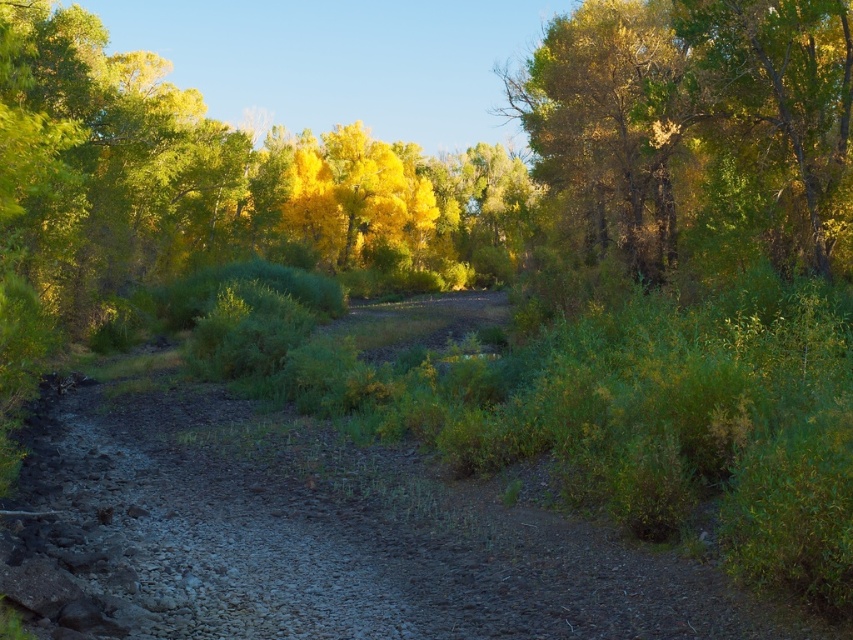
Between dull brown dirt track at center and green leafy tree at upper right, which one is positioned higher?

green leafy tree at upper right is higher up.

Who is more distant from viewer, (585, 596) or (561, 99)?

The point (561, 99) is behind.

Find the location of a particular element. The height and width of the screenshot is (640, 853). dull brown dirt track at center is located at coordinates (334, 532).